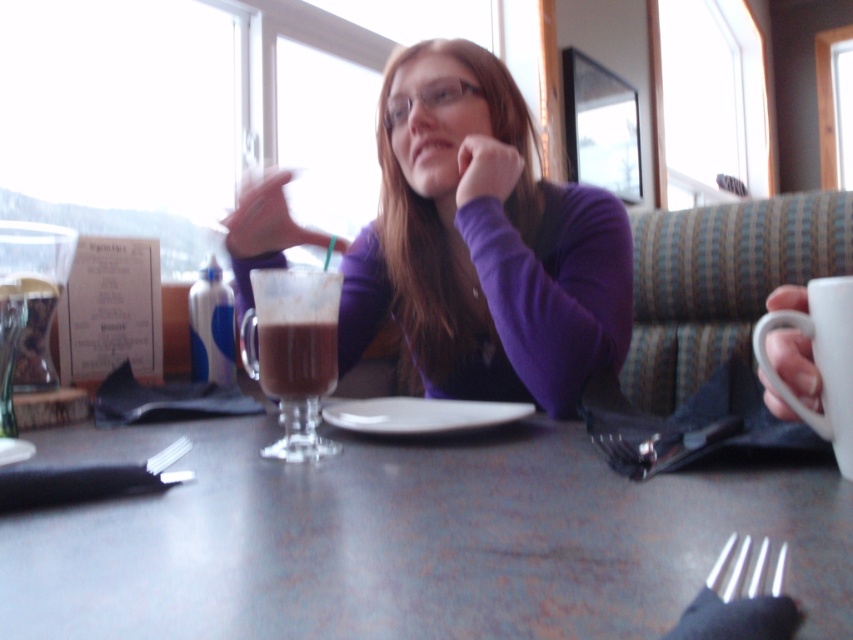
You are a customer at this restaurant and you want to place your napkin on the table. If you want to place it near the white glossy plate at center and the white plastic fork at lower center, which object is taller so that the napkin can be placed underneath it?

The white glossy plate at center is much taller than the white plastic fork at lower center, so the napkin can be placed underneath the plate.

You are a server in a restaurant and need to place a new menu holder between the matte plastic cup at center and the white plastic fork at lower center. Given that the menu holder is 10 cm wide, can you fit it between them without moving either item?

The matte plastic cup at center is larger in size than the white plastic fork at lower center, but the exact distance between them isn generated in the Objects Description. Therefore, it is unclear if the menu holder will fit without knowing the actual space available between the two items.